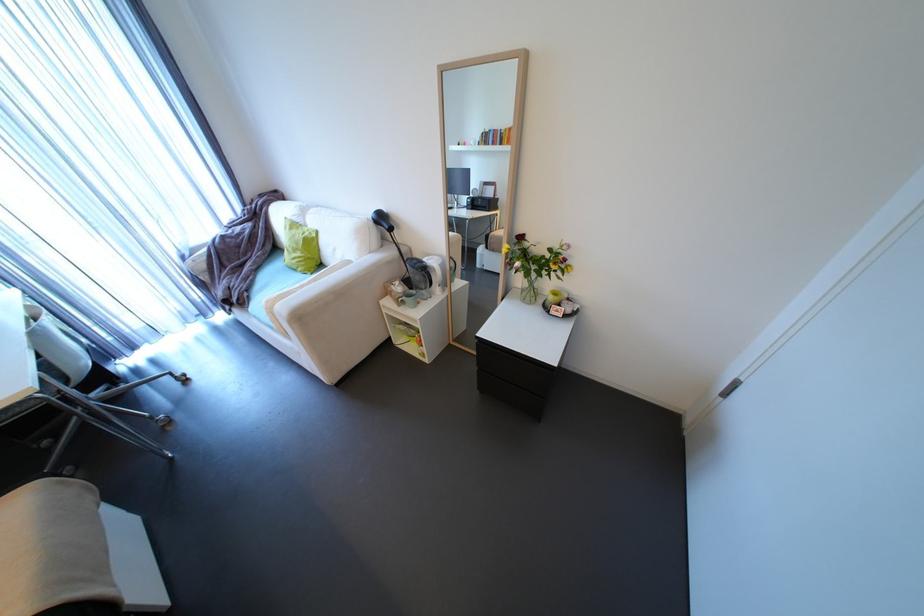
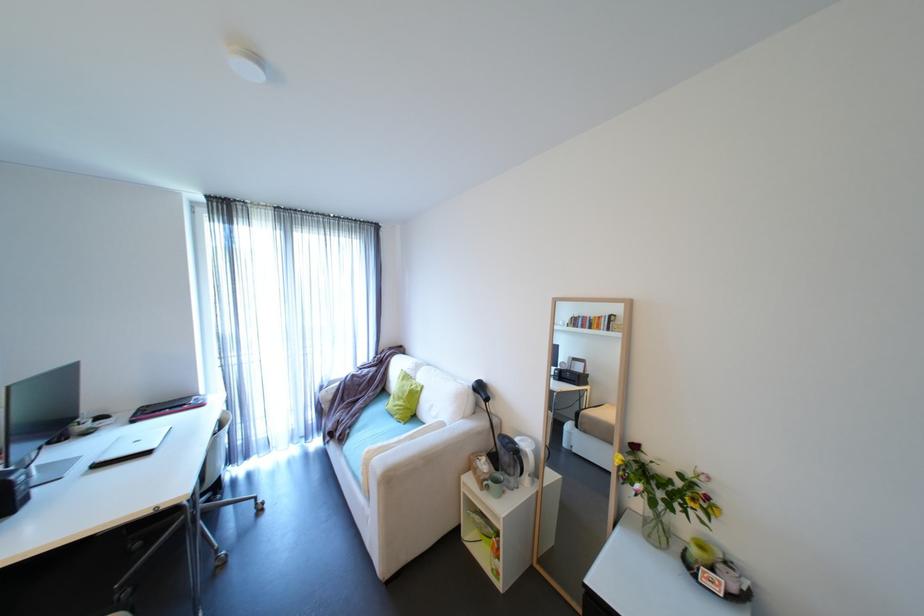
Locate, in the second image, the point that corresponds to point 248,302 in the first image.

(347, 438)